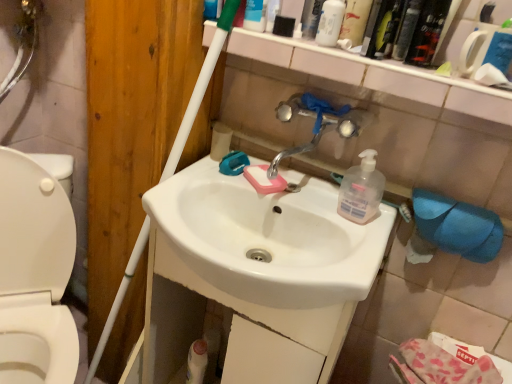
Where is `vacant space in front of translucent plastic soap dispenser at center-right, acting as the second cleaning product starting from the top`? The height and width of the screenshot is (384, 512). vacant space in front of translucent plastic soap dispenser at center-right, acting as the second cleaning product starting from the top is located at coordinates tap(353, 248).